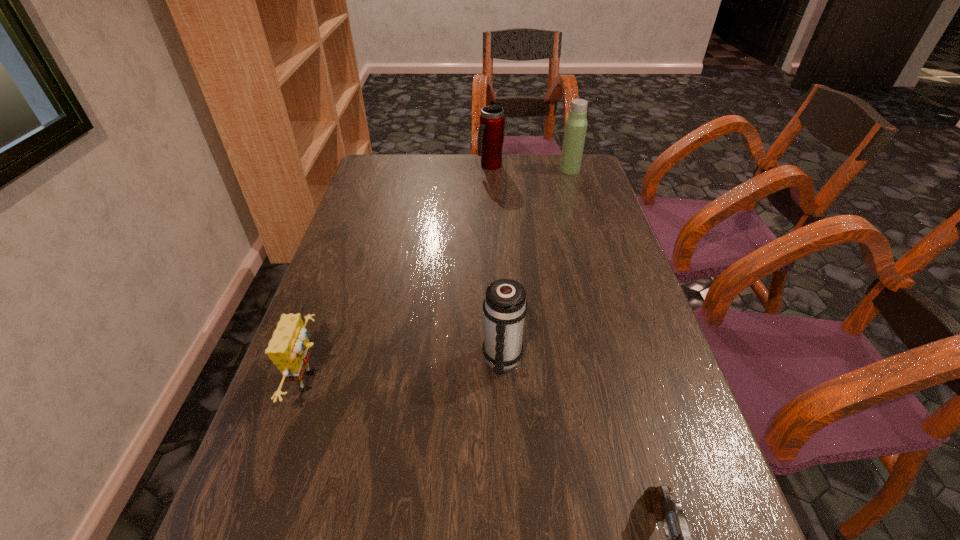
In order to click on the tallest object in this screenshot , I will do `click(576, 124)`.

Image resolution: width=960 pixels, height=540 pixels. In order to click on the tallest thermos bottle in this screenshot , I will do `click(576, 124)`.

Where is `the nearest thermos bottle`? This screenshot has width=960, height=540. the nearest thermos bottle is located at coordinates (505, 307).

Locate an element on the screen. The width and height of the screenshot is (960, 540). sponge is located at coordinates (289, 349).

Identify the location of the leftmost object. The height and width of the screenshot is (540, 960). click(289, 349).

Find the location of a particular element. The height and width of the screenshot is (540, 960). free space located on the left of the rightmost thermos bottle is located at coordinates (501, 170).

Locate an element on the screen. free space located on the side with the handle of the nearest thermos bottle is located at coordinates (509, 494).

Find the location of a particular element. vacant space located 0.280m on the face of the sponge is located at coordinates (468, 381).

I want to click on object that is at the left edge, so click(289, 349).

This screenshot has width=960, height=540. What are the coordinates of `object at the right edge` in the screenshot? It's located at (576, 124).